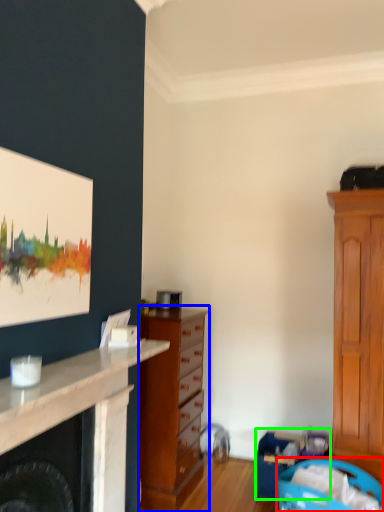
Question: Which object is the farthest from laundry basket (highlighted by a red box)? Choose among these: chest of drawers (highlighted by a blue box) or laundry basket (highlighted by a green box).

Choices:
 (A) chest of drawers
 (B) laundry basket

Answer: (A)